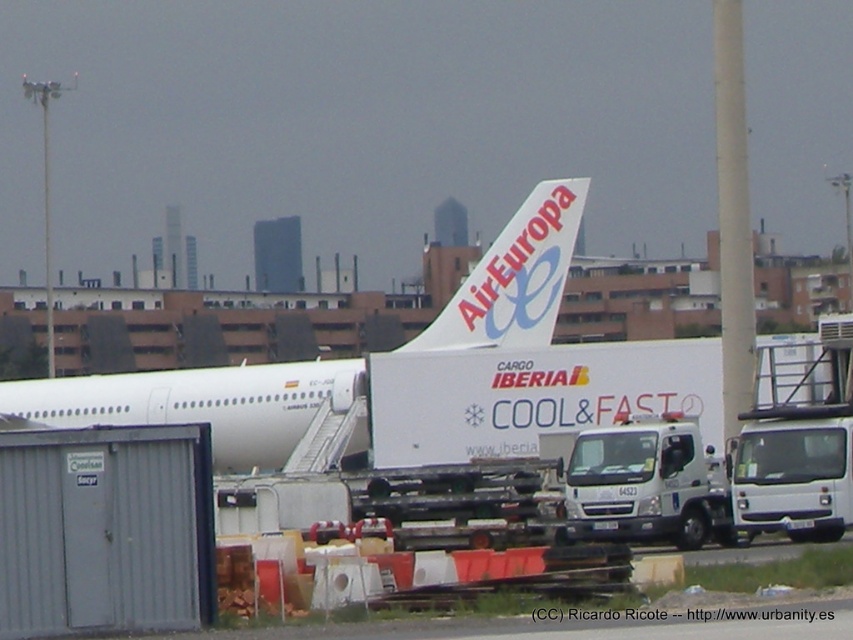
You are an airport worker standing at the edge of the runway. You need to walk towards the white matte airplane at center and the white matte airplane tail at center. Which object will you reach first?

You will reach the white matte airplane at center first because it is positioned to the left of the white matte airplane tail at center, meaning it is closer to your starting point at the runway edge.

You are a photographer standing at the airport. You want to take a photo of the white metallic truck at lower center and the white matte airplane tail at center. Which object should you focus on first if you want to capture both in sharp focus?

You should focus on the white metallic truck at lower center first because it is closer to the viewer than the white matte airplane tail at center. By focusing on the closer object, you can ensure that both are in acceptable focus if they are within the depth of field range.

You are standing at the airport near the AirEuropa aircraft and the IBERIA Cargo container. You notice two points marked on the ground at coordinates point (561, 220) and point (566, 208). Which point is closer to you?

Point (561, 220) is further to the viewer than point (566, 208), so the point closer to you is point (566, 208).